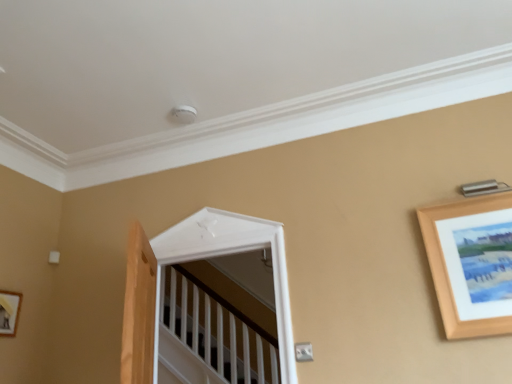
The height and width of the screenshot is (384, 512). I want to click on wooden picture frame at lower left, acting as the 1th picture frame starting from the left, so click(9, 312).

This screenshot has width=512, height=384. Describe the element at coordinates (227, 254) in the screenshot. I see `white glossy door at center` at that location.

You are a GUI agent. You are given a task and a screenshot of the screen. Output one action in this format:
    pyautogui.click(x=<x>, y=<y>)
    Task: Click on the wooden picture frame at lower left, which is the first picture frame in back-to-front order
    The width and height of the screenshot is (512, 384).
    Given the screenshot: What is the action you would take?
    pyautogui.click(x=9, y=312)

Could you measure the distance between wooden picture frame at upper right, the first picture frame in the front-to-back sequence, and white glossy door at center?

wooden picture frame at upper right, the first picture frame in the front-to-back sequence, is 96.40 centimeters from white glossy door at center.

Considering the sizes of wooden picture frame at upper right, arranged as the first picture frame when viewed from the right, and white glossy door at center in the image, is wooden picture frame at upper right, arranged as the first picture frame when viewed from the right, wider or thinner than white glossy door at center?

Considering their sizes, wooden picture frame at upper right, arranged as the first picture frame when viewed from the right, looks slimmer than white glossy door at center.

Is wooden picture frame at upper right, arranged as the first picture frame when viewed from the right, inside the boundaries of white glossy door at center, or outside?

wooden picture frame at upper right, arranged as the first picture frame when viewed from the right, exists outside the volume of white glossy door at center.

Does wooden picture frame at upper right, the first picture frame in the front-to-back sequence, have a smaller size compared to white glossy door at center?

Yes.

Looking at this image, measure the distance from wooden picture frame at lower left, positioned as the 2th picture frame in front-to-back order, to wooden picture frame at upper right, which ranks as the second picture frame in left-to-right order.

They are 2.54 meters apart.

Between wooden picture frame at lower left, acting as the 1th picture frame starting from the left, and wooden picture frame at upper right, arranged as the first picture frame when viewed from the right, which one has smaller width?

Thinner between the two is wooden picture frame at lower left, acting as the 1th picture frame starting from the left.

Does wooden picture frame at lower left, which is the first picture frame in back-to-front order, touch wooden picture frame at upper right, marked as the second picture frame in a back-to-front arrangement?

wooden picture frame at lower left, which is the first picture frame in back-to-front order, and wooden picture frame at upper right, marked as the second picture frame in a back-to-front arrangement, are clearly separated.

What's the angular difference between white glossy door at center and wooden picture frame at upper right, arranged as the first picture frame when viewed from the right,'s facing directions?

white glossy door at center and wooden picture frame at upper right, arranged as the first picture frame when viewed from the right, are facing 1.08 degrees away from each other.

Is white glossy door at center taller than wooden picture frame at upper right, which ranks as the second picture frame in left-to-right order?

Correct, white glossy door at center is much taller as wooden picture frame at upper right, which ranks as the second picture frame in left-to-right order.

From a real-world perspective, which object stands above the other?

white glossy door at center is physically above.

Visually, is white glossy door at center positioned to the left or to the right of wooden picture frame at upper right, the first picture frame in the front-to-back sequence?

Based on their positions, white glossy door at center is located to the left of wooden picture frame at upper right, the first picture frame in the front-to-back sequence.

Do you think wooden picture frame at lower left, which is the first picture frame in back-to-front order, is within white glossy door at center, or outside of it?

The correct answer is: outside.

From a real-world perspective, who is located lower, wooden picture frame at lower left, which is the first picture frame in back-to-front order, or white glossy door at center?

wooden picture frame at lower left, which is the first picture frame in back-to-front order.

I want to click on window above the wooden picture frame at lower left, which is the first picture frame in back-to-front order (from the image's perspective), so click(227, 254).

Measure the distance from wooden picture frame at lower left, which appears as the 2th picture frame when viewed from the right, to white glossy door at center.

The distance of wooden picture frame at lower left, which appears as the 2th picture frame when viewed from the right, from white glossy door at center is 1.10 meters.

Is white glossy door at center surrounding wooden picture frame at lower left, positioned as the 2th picture frame in front-to-back order?

No, wooden picture frame at lower left, positioned as the 2th picture frame in front-to-back order, is not inside white glossy door at center.

From a real-world perspective, is white glossy door at center beneath wooden picture frame at lower left, positioned as the 2th picture frame in front-to-back order?

No.

Where is `picture frame on the left of white glossy door at center`? The width and height of the screenshot is (512, 384). picture frame on the left of white glossy door at center is located at coordinates (9, 312).

Can you tell me how much white glossy door at center and wooden picture frame at lower left, which is the first picture frame in back-to-front order, differ in facing direction?

The angular difference between white glossy door at center and wooden picture frame at lower left, which is the first picture frame in back-to-front order, is 90.4 degrees.

Looking at this image, which object is wider, wooden picture frame at upper right, which ranks as the second picture frame in left-to-right order, or wooden picture frame at lower left, positioned as the 2th picture frame in front-to-back order?

Wider between the two is wooden picture frame at upper right, which ranks as the second picture frame in left-to-right order.

From the image's perspective, which one is positioned higher, wooden picture frame at upper right, marked as the second picture frame in a back-to-front arrangement, or wooden picture frame at lower left, positioned as the 2th picture frame in front-to-back order?

From the image's view, wooden picture frame at upper right, marked as the second picture frame in a back-to-front arrangement, is above.

Would you consider wooden picture frame at upper right, the first picture frame in the front-to-back sequence, to be distant from wooden picture frame at lower left, positioned as the 2th picture frame in front-to-back order?

Indeed, wooden picture frame at upper right, the first picture frame in the front-to-back sequence, is not near wooden picture frame at lower left, positioned as the 2th picture frame in front-to-back order.

Is wooden picture frame at upper right, marked as the second picture frame in a back-to-front arrangement, to the left of wooden picture frame at lower left, positioned as the 2th picture frame in front-to-back order, from the viewer's perspective?

No.

In order to click on window on the left side of wooden picture frame at upper right, the first picture frame in the front-to-back sequence in this screenshot , I will do `click(227, 254)`.

In the image, there is a wooden picture frame at upper right, the first picture frame in the front-to-back sequence. At what (x,y) coordinates should I click in order to perform the action: click on picture frame below it (from a real-world perspective). Please return your answer as a coordinate pair (x, y). Looking at the image, I should click on (9, 312).

From the image, which object appears to be nearer to wooden picture frame at upper right, marked as the second picture frame in a back-to-front arrangement, wooden picture frame at lower left, acting as the 1th picture frame starting from the left, or white glossy door at center?

white glossy door at center is closer to wooden picture frame at upper right, marked as the second picture frame in a back-to-front arrangement.

Considering their positions, is wooden picture frame at upper right, marked as the second picture frame in a back-to-front arrangement, positioned closer to white glossy door at center than wooden picture frame at lower left, which is the first picture frame in back-to-front order?

wooden picture frame at upper right, marked as the second picture frame in a back-to-front arrangement, is closer to white glossy door at center.

Which object lies nearer to the anchor point wooden picture frame at upper right, arranged as the first picture frame when viewed from the right, white glossy door at center or wooden picture frame at lower left, acting as the 1th picture frame starting from the left?

Among the two, white glossy door at center is located nearer to wooden picture frame at upper right, arranged as the first picture frame when viewed from the right.

Looking at the image, which one is located further to white glossy door at center, wooden picture frame at lower left, which appears as the 2th picture frame when viewed from the right, or wooden picture frame at upper right, marked as the second picture frame in a back-to-front arrangement?

The object further to white glossy door at center is wooden picture frame at lower left, which appears as the 2th picture frame when viewed from the right.

From the image, which object appears to be farther from wooden picture frame at lower left, acting as the 1th picture frame starting from the left, white glossy door at center or wooden picture frame at upper right, which ranks as the second picture frame in left-to-right order?

wooden picture frame at upper right, which ranks as the second picture frame in left-to-right order, is further to wooden picture frame at lower left, acting as the 1th picture frame starting from the left.

When comparing their distances from wooden picture frame at lower left, which appears as the 2th picture frame when viewed from the right, does wooden picture frame at upper right, the first picture frame in the front-to-back sequence, or white glossy door at center seem closer?

white glossy door at center is closer to wooden picture frame at lower left, which appears as the 2th picture frame when viewed from the right.

Where is `window located between wooden picture frame at lower left, positioned as the 2th picture frame in front-to-back order, and wooden picture frame at upper right, arranged as the first picture frame when viewed from the right, in the left-right direction`? This screenshot has width=512, height=384. window located between wooden picture frame at lower left, positioned as the 2th picture frame in front-to-back order, and wooden picture frame at upper right, arranged as the first picture frame when viewed from the right, in the left-right direction is located at coordinates (227, 254).